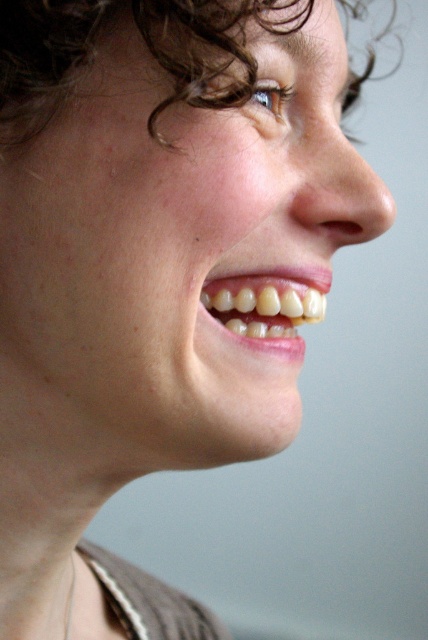
In the image, you see a person with a wide smile. The smooth skin face at center and curly brown hair at upper center are both visible. Which object is positioned to the left of the other?

The smooth skin face at center is to the left of curly brown hair at upper center.

You are a photographer adjusting the lighting for a portrait. You notice the smooth skin face at center and the curly brown hair at upper center in the frame. Which object would require more space in the lighting setup to accommodate its width?

The curly brown hair at upper center requires more space in the lighting setup because it is wider than the smooth skin face at center.

You are a photographer trying to capture a closeup of the smooth skin face at center. The camera lens is 12 inches away from the subject. Is the current distance sufficient to avoid blurring the image?

The camera lens is 12 inches away from the smooth skin face at center, which is less than the recommended 13.39 inches. This distance may cause the image to blur, so moving back slightly would be advisable.